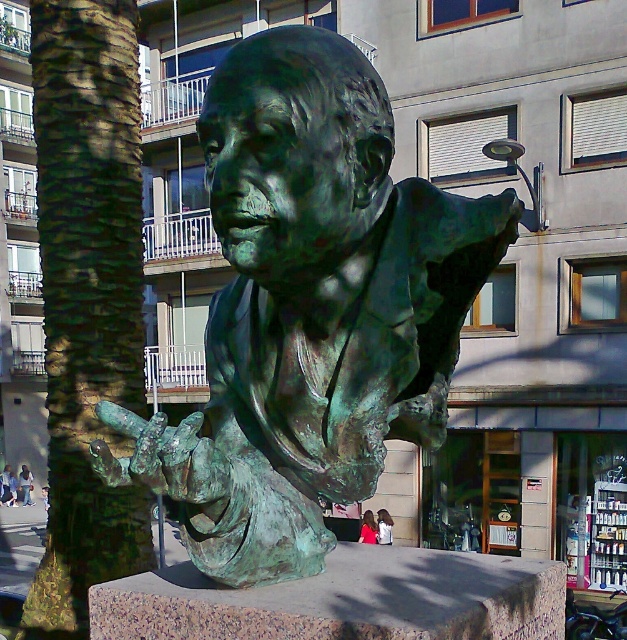
Question: Can you confirm if green patina bust at center is positioned to the right of dark blue jeans at lower left?

Choices:
 (A) yes
 (B) no

Answer: (A)

Question: Among these objects, which one is farthest from the camera?

Choices:
 (A) blue fabric jacket at lower left
 (B) dark blue jeans at lower left

Answer: (B)

Question: Based on their relative distances, which object is nearer to the blue fabric jacket at lower left?

Choices:
 (A) green textured bark at left
 (B) dark blue jeans at lower left

Answer: (B)

Question: Does green patina bust at center appear on the right side of dark blue jeans at lower left?

Choices:
 (A) yes
 (B) no

Answer: (A)

Question: Which is nearer to the green textured bark at left?

Choices:
 (A) red shirt at lower center
 (B) green patina bust at center

Answer: (B)

Question: Considering the relative positions of red shirt at lower center and dark blue jeans at lower left in the image provided, where is red shirt at lower center located with respect to dark blue jeans at lower left?

Choices:
 (A) right
 (B) left

Answer: (A)